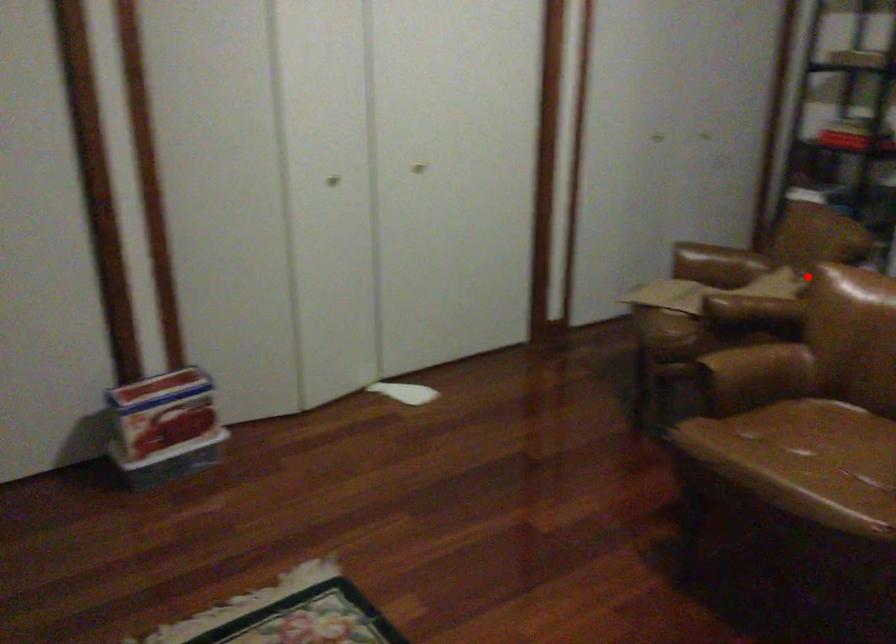
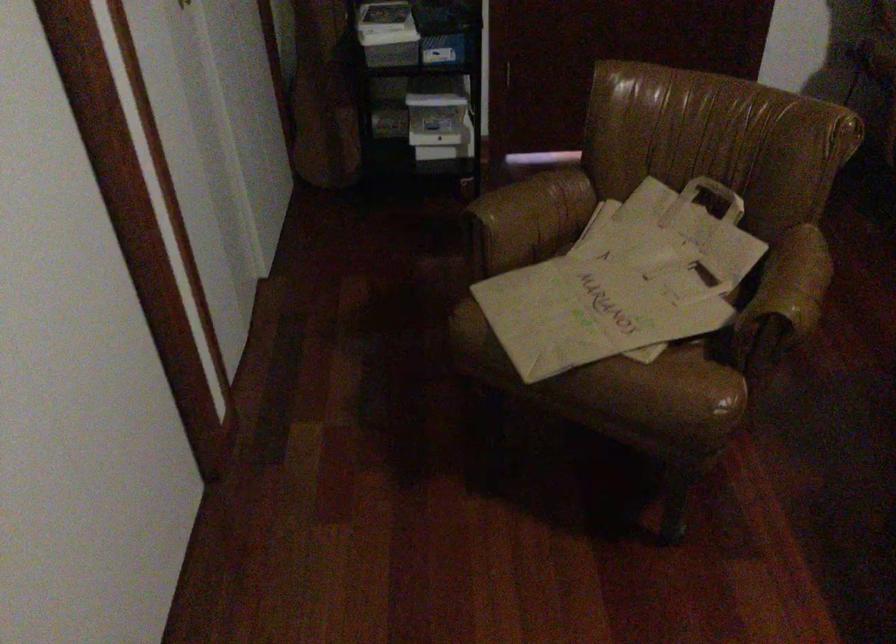
In the second image, find the point that corresponds to the highlighted location in the first image.

(716, 194)